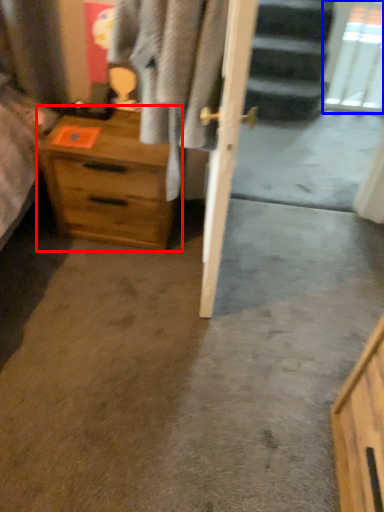
Question: Which object appears farthest to the camera in this image, chest of drawers (highlighted by a red box) or glass door (highlighted by a blue box)?

Choices:
 (A) chest of drawers
 (B) glass door

Answer: (B)